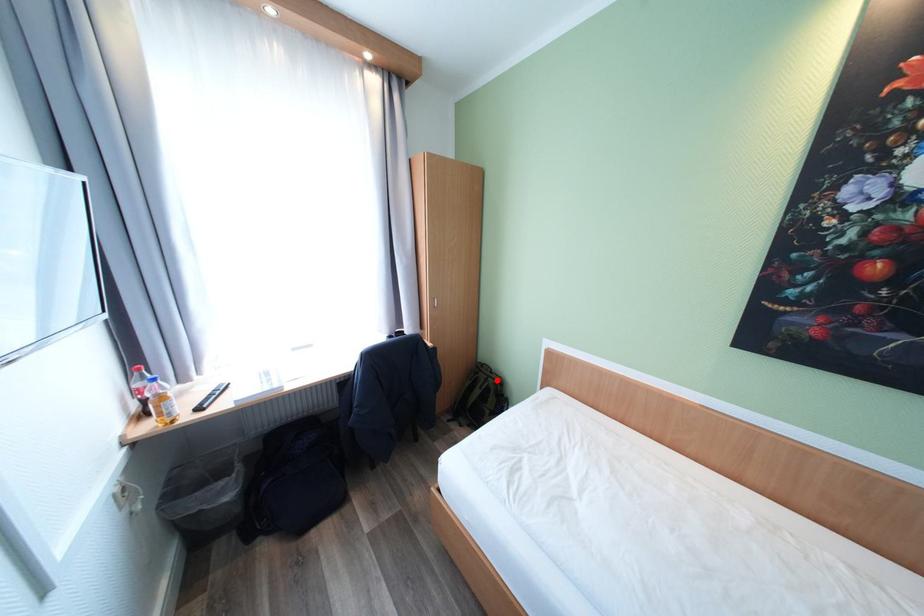
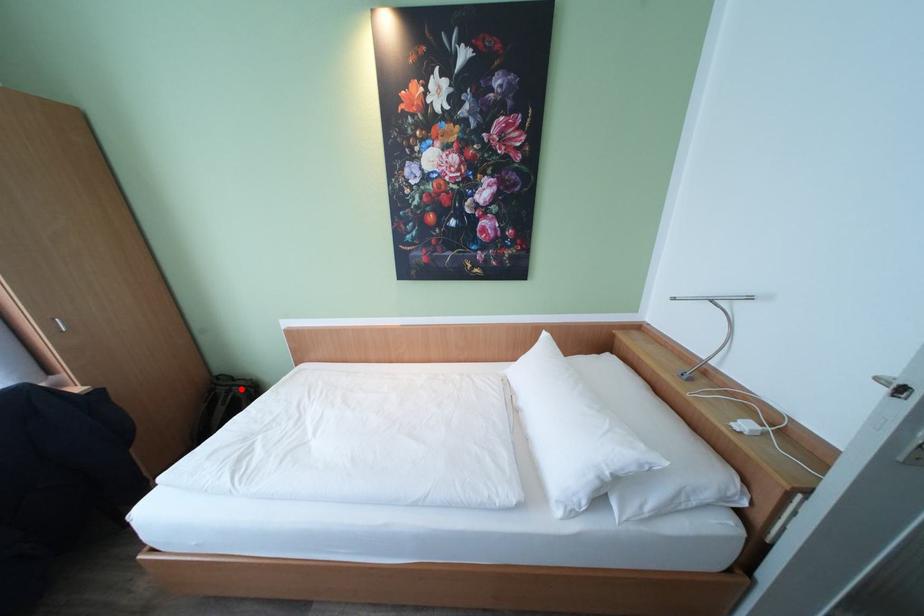
I am providing you with two images of the same scene from different viewpoints. A red point is marked on the first image and another point is marked on the second image. Does the point marked in image1 correspond to the same location as the one in image2?

Yes